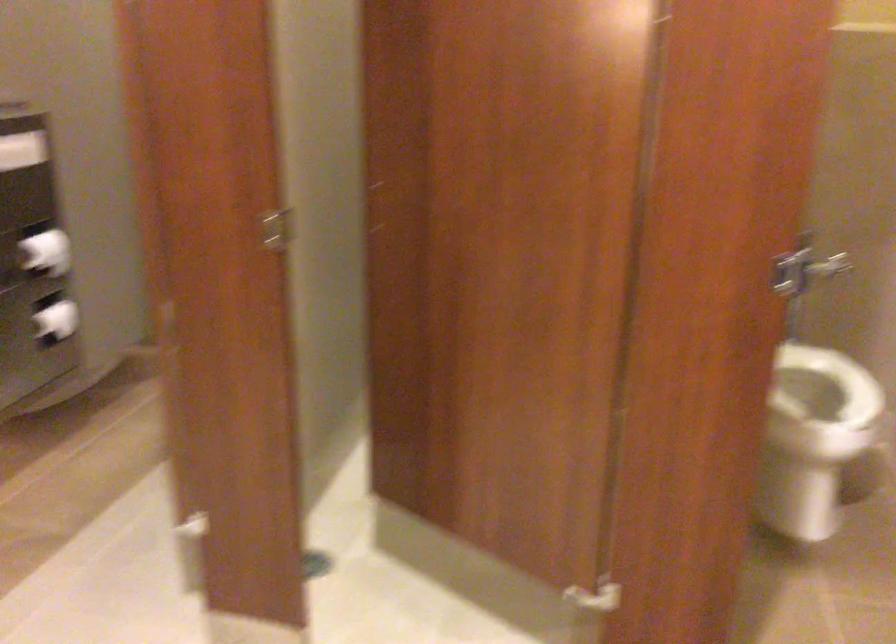
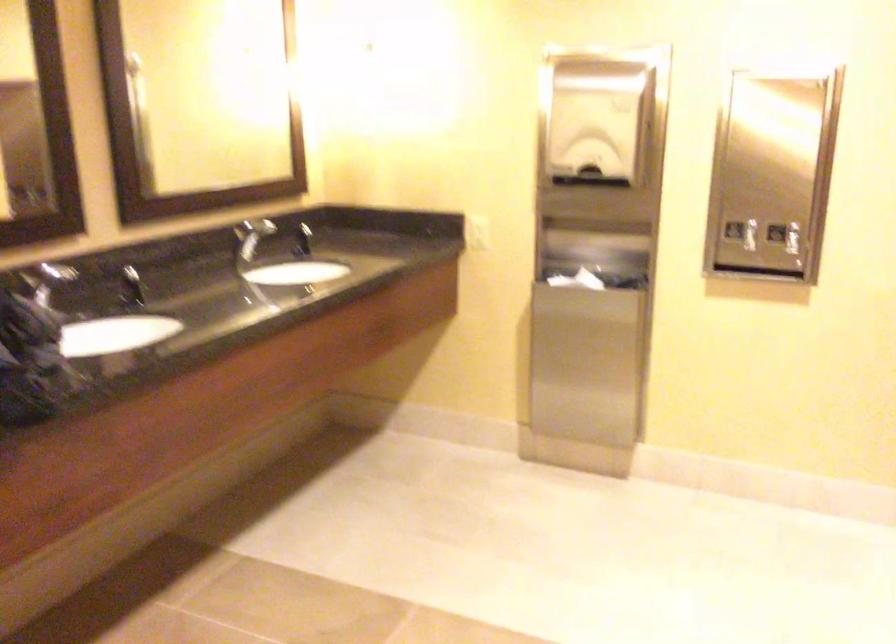
First-person continuous shooting, in which direction is the camera rotating?

The rotation direction of the camera is left-down.